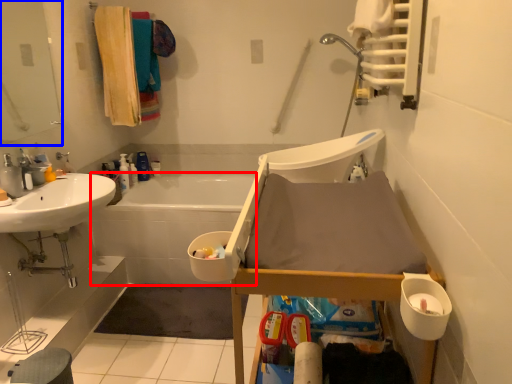
Question: Among these objects, which one is farthest to the camera, bath (highlighted by a red box) or mirror (highlighted by a blue box)?

Choices:
 (A) bath
 (B) mirror

Answer: (A)